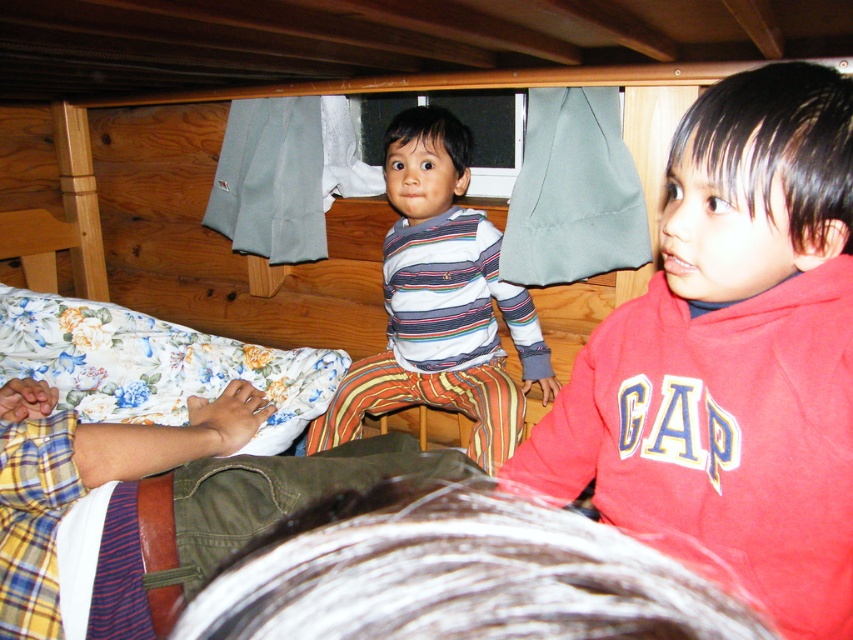
Who is more forward, (x=714, y=316) or (x=398, y=324)?

Positioned in front is point (x=714, y=316).

This screenshot has height=640, width=853. Describe the element at coordinates (733, 353) in the screenshot. I see `red cotton hoodie at upper right` at that location.

Where is `red cotton hoodie at upper right`? red cotton hoodie at upper right is located at coordinates (733, 353).